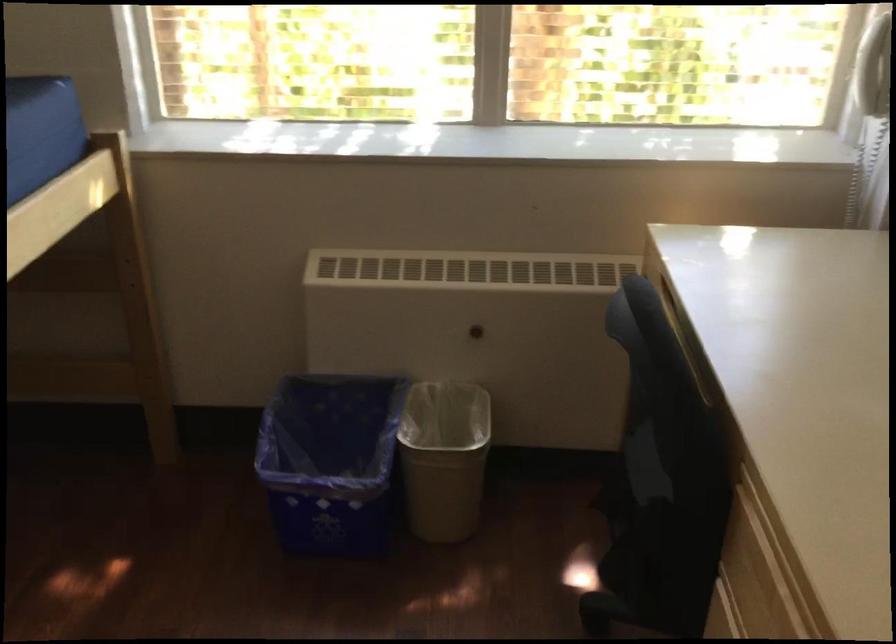
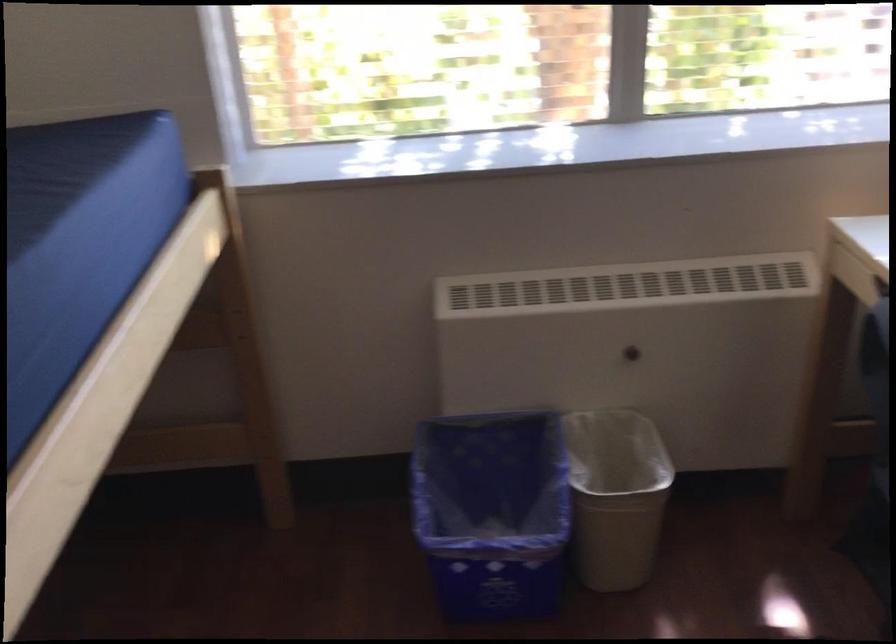
Locate, in the second image, the point that corresponds to [348,465] in the first image.

(492, 512)